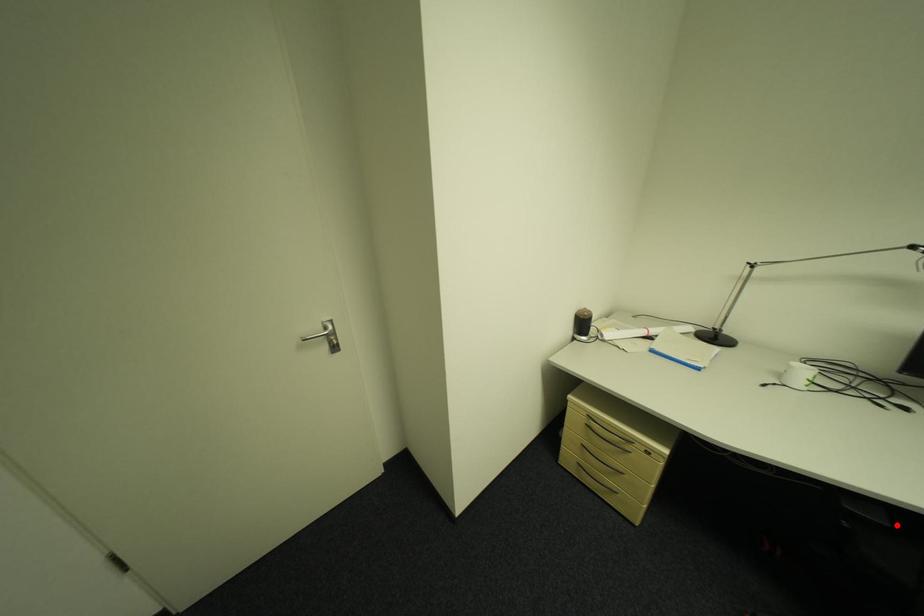
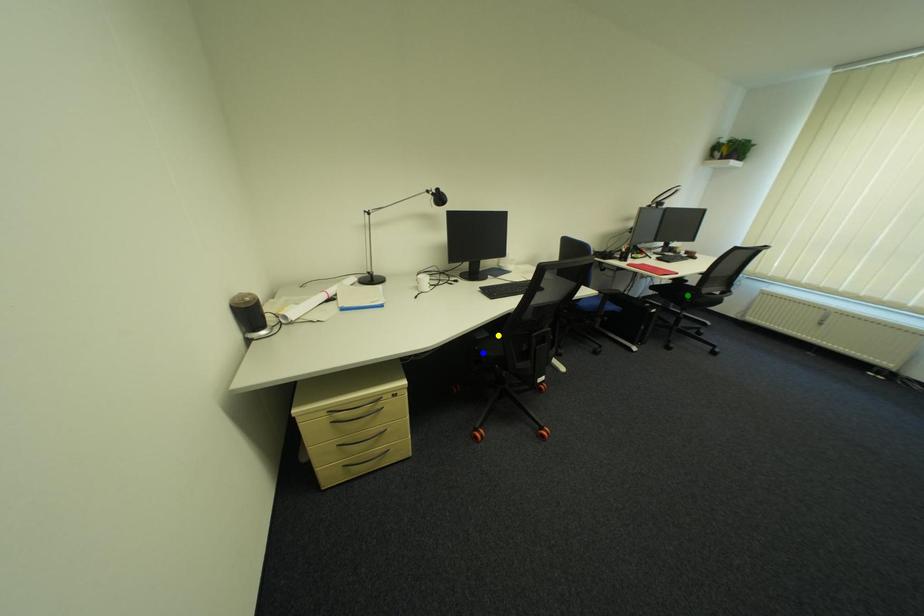
Question: I am providing you with two images of the same scene from different viewpoints. A red point is marked on the first image. You are given multiple points on the second image. Which point in image 2 represents the same 3d spot as the red point in image 1?

Choices:
 (A) yellow point
 (B) green point
 (C) blue point

Answer: (A)